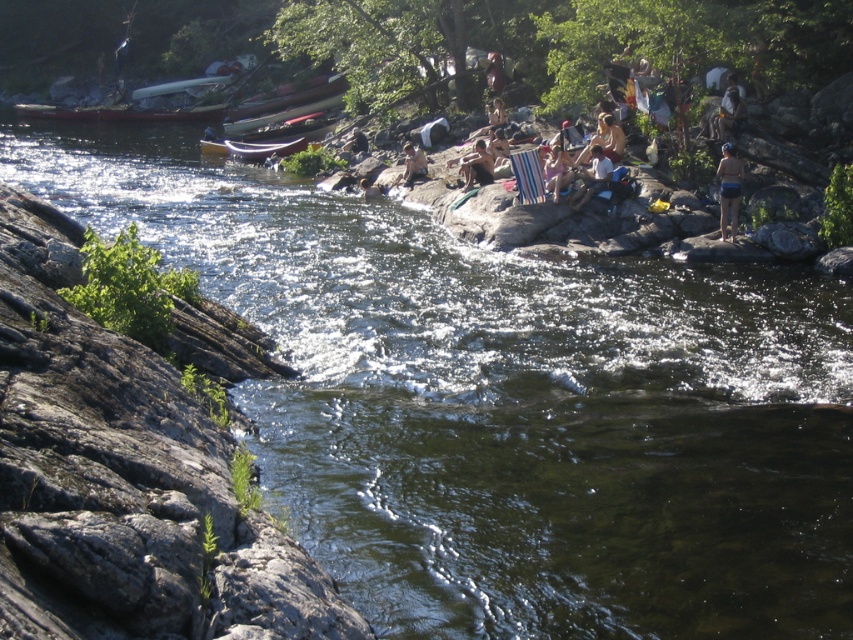
You are a photographer positioned at the riverside. You want to take a photo that includes both the white cotton shirt at center and the striped fabric bag at center. Which object should you focus on first to ensure both are in sharp focus?

You should focus on the white cotton shirt at center first since it is closer to the viewer than the striped fabric bag at center. By focusing on the closer object, the farther one will still be within the depth of field, ensuring both are in focus.

You are a photographer planning to take a portrait of someone sitting on the rocky shoreline. You have a white cotton shirt at center and a striped fabric bag at center. Which item should you place behind the subject to ensure it covers more of the distracting background?

The white cotton shirt at center is bigger than the striped fabric bag at center, so placing the white cotton shirt at center behind the subject will cover more of the distracting background.